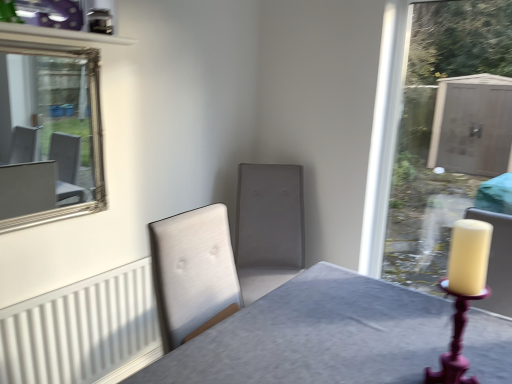
Question: From the image's perspective, is silver/glass mirror at upper left beneath matte gray swivel chair at center?

Choices:
 (A) no
 (B) yes

Answer: (A)

Question: Considering the relative sizes of silver/glass mirror at upper left and matte gray swivel chair at center in the image provided, is silver/glass mirror at upper left smaller than matte gray swivel chair at center?

Choices:
 (A) yes
 (B) no

Answer: (A)

Question: Is there a large distance between silver/glass mirror at upper left and matte gray swivel chair at center?

Choices:
 (A) no
 (B) yes

Answer: (B)

Question: Is silver/glass mirror at upper left positioned behind matte gray swivel chair at center?

Choices:
 (A) yes
 (B) no

Answer: (B)

Question: Is silver/glass mirror at upper left outside of matte gray swivel chair at center?

Choices:
 (A) no
 (B) yes

Answer: (B)

Question: Is the surface of silver/glass mirror at upper left in direct contact with matte gray swivel chair at center?

Choices:
 (A) yes
 (B) no

Answer: (B)

Question: Is the position of white ribbed radiator at lower left less distant than that of silver/glass mirror at upper left?

Choices:
 (A) no
 (B) yes

Answer: (A)

Question: Would you say white ribbed radiator at lower left contains silver/glass mirror at upper left?

Choices:
 (A) yes
 (B) no

Answer: (B)

Question: Considering the relative sizes of white ribbed radiator at lower left and silver/glass mirror at upper left in the image provided, is white ribbed radiator at lower left thinner than silver/glass mirror at upper left?

Choices:
 (A) no
 (B) yes

Answer: (B)

Question: Does white ribbed radiator at lower left have a larger size compared to silver/glass mirror at upper left?

Choices:
 (A) no
 (B) yes

Answer: (B)

Question: Is the depth of white ribbed radiator at lower left greater than that of silver/glass mirror at upper left?

Choices:
 (A) no
 (B) yes

Answer: (B)

Question: Considering the relative sizes of white ribbed radiator at lower left and silver/glass mirror at upper left in the image provided, is white ribbed radiator at lower left wider than silver/glass mirror at upper left?

Choices:
 (A) yes
 (B) no

Answer: (B)

Question: Is matte gray swivel chair at center thinner than silver/glass mirror at upper left?

Choices:
 (A) yes
 (B) no

Answer: (B)